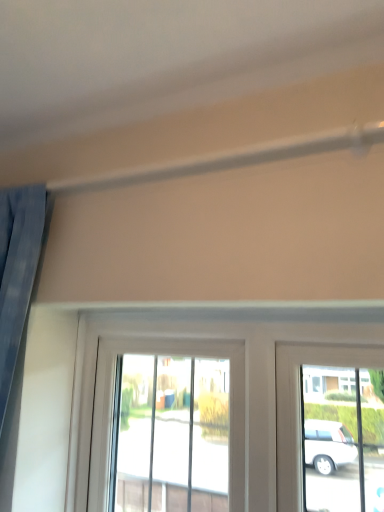
Locate an element on the screen. Image resolution: width=384 pixels, height=512 pixels. white glossy pipe at upper center is located at coordinates (231, 159).

The image size is (384, 512). What do you see at coordinates (231, 159) in the screenshot?
I see `white glossy pipe at upper center` at bounding box center [231, 159].

Find the location of a particular element. This screenshot has height=512, width=384. white glossy pipe at upper center is located at coordinates (231, 159).